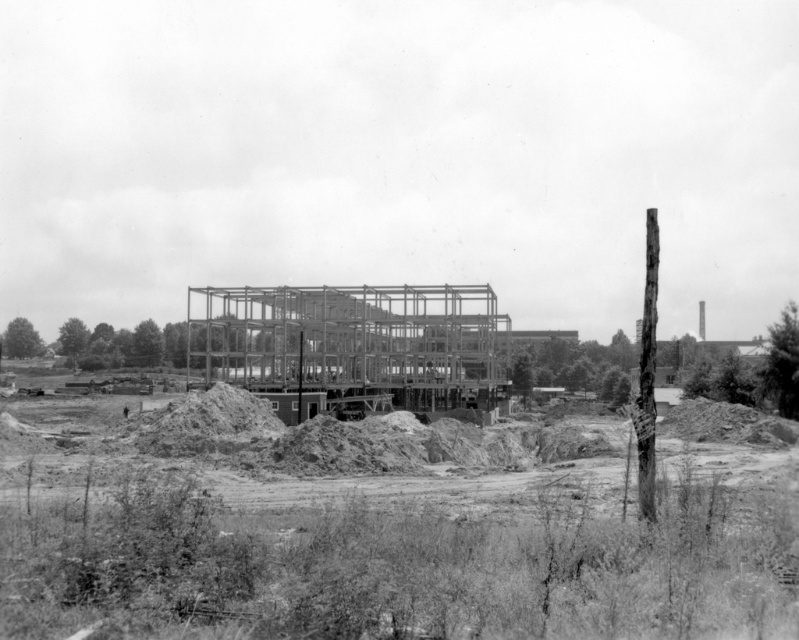
Is dirt at center thinner than metallic framework at center?

Indeed, dirt at center has a lesser width compared to metallic framework at center.

Does dirt at center appear on the right side of metallic framework at center?

Indeed, dirt at center is positioned on the right side of metallic framework at center.

Where is `dirt at center`? Image resolution: width=799 pixels, height=640 pixels. dirt at center is located at coordinates (378, 540).